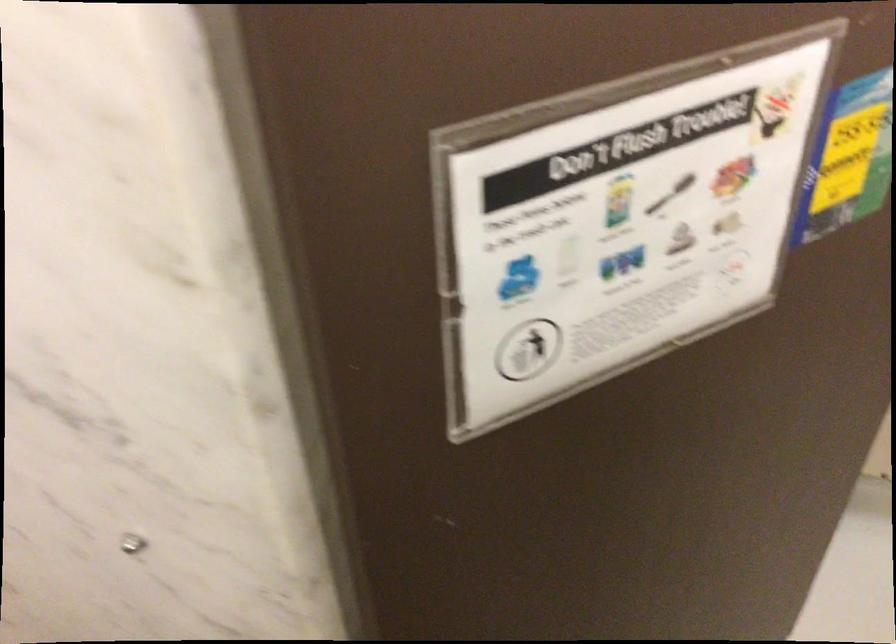
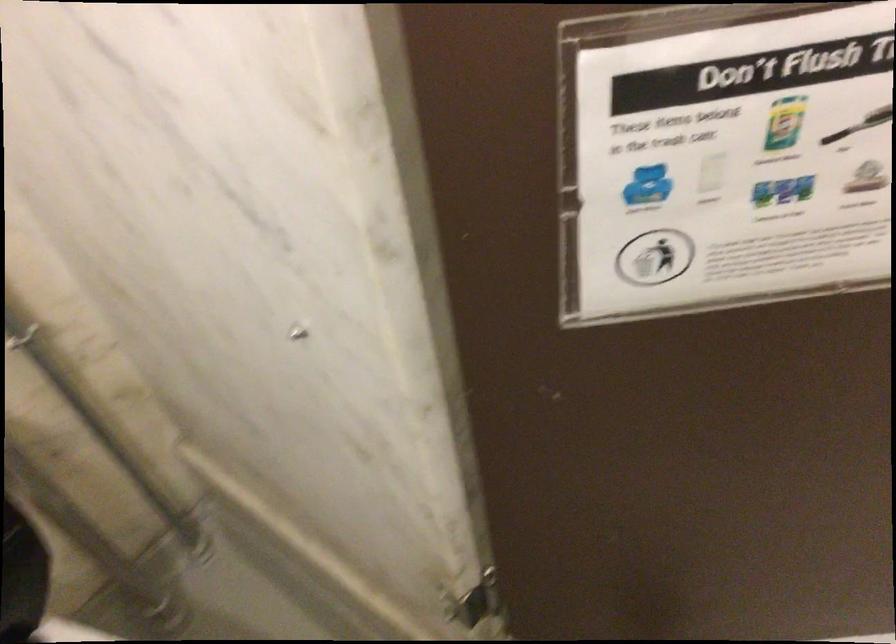
Question: The images are taken continuously from a first-person perspective. In which direction are you moving?

Choices:
 (A) Left
 (B) Right
 (C) Forward
 (D) Backward

Answer: (B)